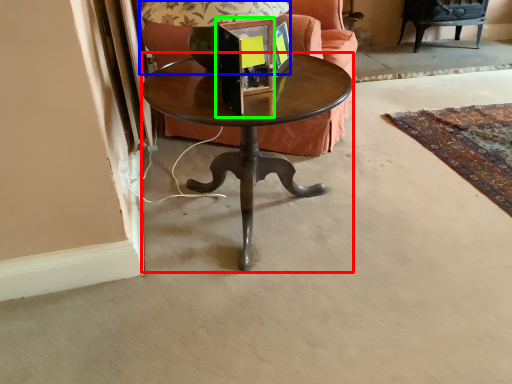
Question: Which is nearer to the coffee table (highlighted by a red box)? table lamp (highlighted by a blue box) or picture frame (highlighted by a green box).

Choices:
 (A) table lamp
 (B) picture frame

Answer: (B)